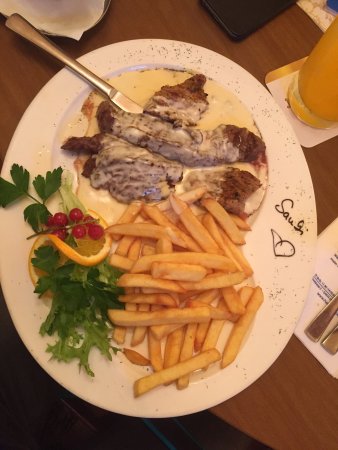
This screenshot has height=450, width=338. What are the coordinates of `phone` in the screenshot? It's located at (245, 24).